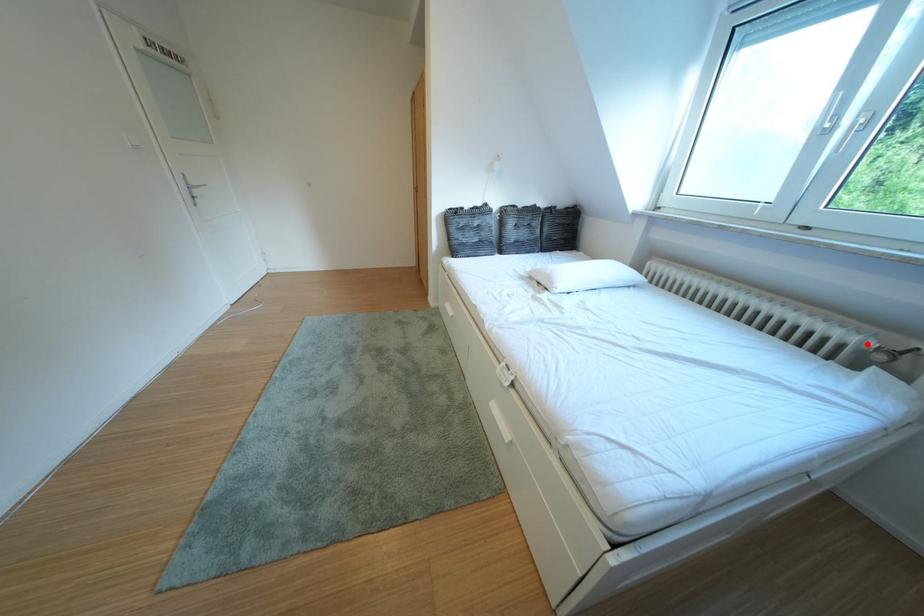
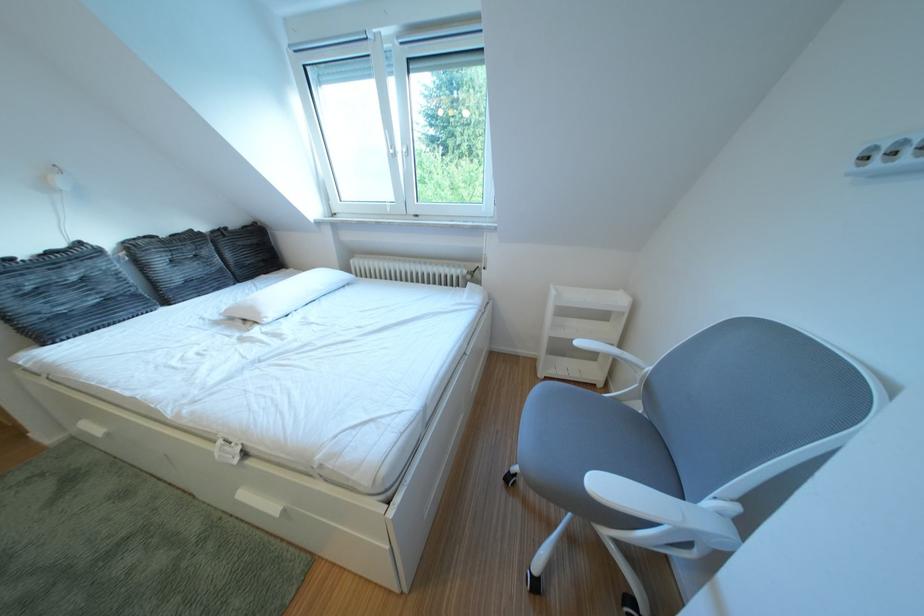
In the second image, find the point that corresponds to the highlighted location in the first image.

(472, 277)